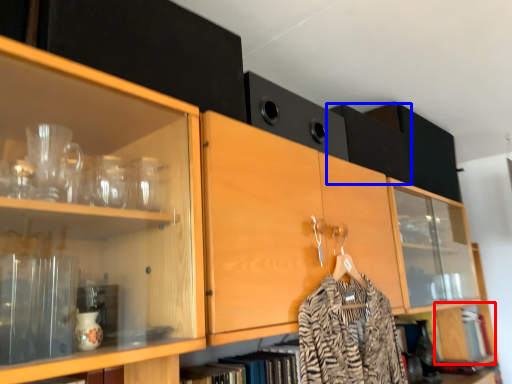
Question: Which object appears closest to the camera in this image, cabinetry (highlighted by a red box) or cabinetry (highlighted by a blue box)?

Choices:
 (A) cabinetry
 (B) cabinetry

Answer: (B)